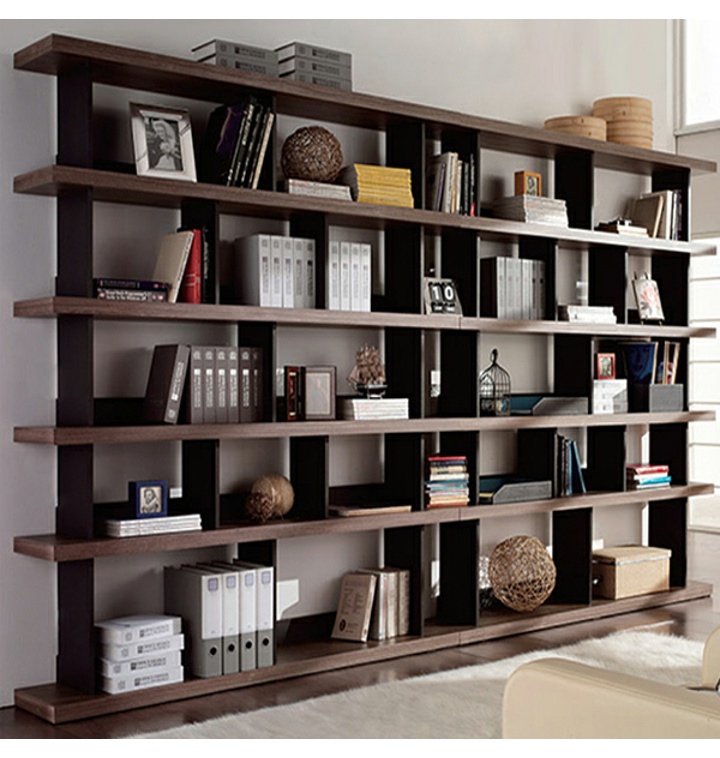
At what (x,y) coordinates should I click in order to perform the action: click on decor balls. Please return your answer as a coordinate pair (x, y). Looking at the image, I should click on (521, 572), (261, 505), (284, 500), (325, 158).